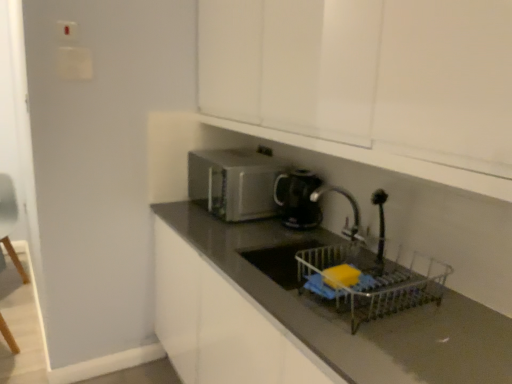
Image resolution: width=512 pixels, height=384 pixels. Identify the location of light blue fabric armchair at left. click(x=9, y=220).

The width and height of the screenshot is (512, 384). What do you see at coordinates (9, 220) in the screenshot? I see `light blue fabric armchair at left` at bounding box center [9, 220].

You are a GUI agent. You are given a task and a screenshot of the screen. Output one action in this format:
    pyautogui.click(x=<x>, y=<y>)
    Task: Click on the white glossy cabinet at upper center
    The height and width of the screenshot is (384, 512).
    Given the screenshot: What is the action you would take?
    pyautogui.click(x=367, y=73)

Measure the distance between point (202, 236) and camera.

The distance of point (202, 236) from camera is 5.88 feet.

You are a GUI agent. You are given a task and a screenshot of the screen. Output one action in this format:
    pyautogui.click(x=<x>, y=<y>)
    Task: Click on the light blue fabric armchair at left
    
    Given the screenshot: What is the action you would take?
    pyautogui.click(x=9, y=220)

Who is shorter, satin silver microwave at center or white glossy cabinet at upper center?

With less height is satin silver microwave at center.

Consider the image. Could you tell me if satin silver microwave at center is facing white glossy cabinet at upper center?

No, satin silver microwave at center does not turn towards white glossy cabinet at upper center.

Is white glossy cabinet at upper center inside satin silver microwave at center?

No.

Would you say black glossy countertop at center is inside or outside white glossy cabinet at upper center?

black glossy countertop at center is located beyond the bounds of white glossy cabinet at upper center.

Is white glossy cabinet at upper center at the back of black glossy countertop at center?

That's not correct — black glossy countertop at center is not looking away from white glossy cabinet at upper center.

In terms of height, does black glossy countertop at center look taller or shorter compared to white glossy cabinet at upper center?

In the image, black glossy countertop at center appears to be taller than white glossy cabinet at upper center.

Is black glossy countertop at center next to white glossy cabinet at upper center?

black glossy countertop at center is not next to white glossy cabinet at upper center, and they're not touching.

Considering their positions, is light blue fabric armchair at left located in front of or behind metallic silver dish rack at lower center?

In the image, light blue fabric armchair at left appears behind metallic silver dish rack at lower center.

Consider the image. What's the angular difference between light blue fabric armchair at left and metallic silver dish rack at lower center's facing directions?

There is a 47.2-degree angle between the facing directions of light blue fabric armchair at left and metallic silver dish rack at lower center.

Can you confirm if light blue fabric armchair at left is wider than metallic silver dish rack at lower center?

Indeed, light blue fabric armchair at left has a greater width compared to metallic silver dish rack at lower center.

Locate an element on the screen. The height and width of the screenshot is (384, 512). armchair behind the metallic silver dish rack at lower center is located at coordinates (9, 220).

Is metallic silver dish rack at lower center aimed at satin silver microwave at center?

No, metallic silver dish rack at lower center is not facing towards satin silver microwave at center.

Which of these two, metallic silver dish rack at lower center or satin silver microwave at center, stands shorter?

With less height is metallic silver dish rack at lower center.

From a real-world perspective, does metallic silver dish rack at lower center stand above satin silver microwave at center?

No.

Does point (315, 272) appear closer or farther from the camera than point (210, 165)?

Point (315, 272).

Can you tell me how much satin silver microwave at center and metallic silver dish rack at lower center differ in facing direction?

0.716 degrees separate the facing orientations of satin silver microwave at center and metallic silver dish rack at lower center.

Is the surface of satin silver microwave at center in direct contact with metallic silver dish rack at lower center?

They are not placed beside each other.

From the image's perspective, does satin silver microwave at center appear lower than metallic silver dish rack at lower center?

No, from the image's perspective, satin silver microwave at center is not beneath metallic silver dish rack at lower center.

From a real-world perspective, is satin silver microwave at center over metallic silver dish rack at lower center?

Indeed, from a real-world perspective, satin silver microwave at center stands above metallic silver dish rack at lower center.

Consider the image. Is metallic silver dish rack at lower center thinner than white glossy cabinet at upper center?

Indeed, metallic silver dish rack at lower center has a lesser width compared to white glossy cabinet at upper center.

Would you say metallic silver dish rack at lower center is outside white glossy cabinet at upper center?

Absolutely, metallic silver dish rack at lower center is external to white glossy cabinet at upper center.

Could you tell me if metallic silver dish rack at lower center is facing white glossy cabinet at upper center?

No, metallic silver dish rack at lower center does not turn towards white glossy cabinet at upper center.

Is metallic silver dish rack at lower center placed right next to white glossy cabinet at upper center?

metallic silver dish rack at lower center and white glossy cabinet at upper center are clearly separated.

Image resolution: width=512 pixels, height=384 pixels. Identify the location of armchair below the satin silver microwave at center (from a real-world perspective). (9, 220).

From the image's perspective, is light blue fabric armchair at left located above or below satin silver microwave at center?

From the image's perspective, light blue fabric armchair at left appears below satin silver microwave at center.

From the picture: Is light blue fabric armchair at left surrounding satin silver microwave at center?

No, satin silver microwave at center is located outside of light blue fabric armchair at left.

The image size is (512, 384). Find the location of `cabinetry above the satin silver microwave at center (from a real-world perspective)`. cabinetry above the satin silver microwave at center (from a real-world perspective) is located at coordinates (367, 73).

Find the location of a particular element. The image size is (512, 384). countertop lying below the white glossy cabinet at upper center (from the image's perspective) is located at coordinates (362, 326).

Based on the photo, considering their positions, is satin silver microwave at center positioned closer to black glossy countertop at center than black glossy kettle at center?

satin silver microwave at center lies closer to black glossy countertop at center than the other object.

Consider the image. Estimate the real-world distances between objects in this image. Which object is further from satin silver microwave at center, light blue fabric armchair at left or metallic silver dish rack at lower center?

light blue fabric armchair at left.

From the image, which object appears to be nearer to metallic silver dish rack at lower center, black glossy kettle at center or black glossy countertop at center?

The object closer to metallic silver dish rack at lower center is black glossy countertop at center.

Considering their positions, is black glossy countertop at center positioned closer to metallic silver dish rack at lower center than white glossy cabinet at upper center?

Based on the image, black glossy countertop at center appears to be nearer to metallic silver dish rack at lower center.

Estimate the real-world distances between objects in this image. Which object is further from black glossy countertop at center, white glossy cabinet at upper center or light blue fabric armchair at left?

light blue fabric armchair at left is positioned further to the anchor black glossy countertop at center.

In the scene shown: Considering their positions, is light blue fabric armchair at left positioned closer to metallic silver dish rack at lower center than white glossy cabinet at upper center?

The object closer to metallic silver dish rack at lower center is white glossy cabinet at upper center.

From the image, which object appears to be farther from metallic silver dish rack at lower center, black glossy kettle at center or white glossy cabinet at upper center?

Among the two, white glossy cabinet at upper center is located further to metallic silver dish rack at lower center.

Looking at the image, which one is located closer to white glossy cabinet at upper center, satin silver microwave at center or metallic silver dish rack at lower center?

The object closer to white glossy cabinet at upper center is metallic silver dish rack at lower center.

Where is `basket between white glossy cabinet at upper center and black glossy countertop at center from top to bottom`? basket between white glossy cabinet at upper center and black glossy countertop at center from top to bottom is located at coordinates (369, 280).

Find the location of a particular element. The width and height of the screenshot is (512, 384). countertop located between light blue fabric armchair at left and white glossy cabinet at upper center in the left-right direction is located at coordinates (362, 326).

Find the location of a particular element. home appliance between light blue fabric armchair at left and black glossy kettle at center from left to right is located at coordinates (234, 183).

Locate an element on the screen. The height and width of the screenshot is (384, 512). kitchen appliance between light blue fabric armchair at left and metallic silver dish rack at lower center in the horizontal direction is located at coordinates (298, 199).